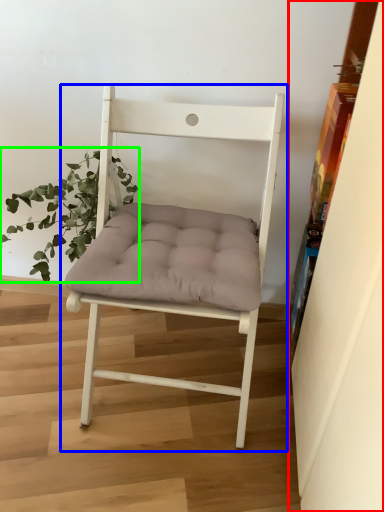
Question: Estimate the real-world distances between objects in this image. Which object is farther from shelf (highlighted by a red box), chair (highlighted by a blue box) or houseplant (highlighted by a green box)?

Choices:
 (A) chair
 (B) houseplant

Answer: (B)